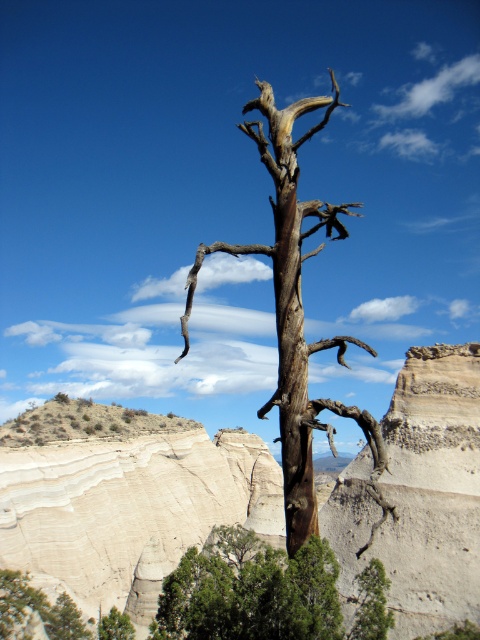
You are an artist sketching this landscape. You want to draw the brown rough bark tree at center and the green matte tree at lower right. Which tree should you sketch first if you follow the rule of drawing closer objects before distant ones?

The brown rough bark tree at center should be sketched first because it is closer to the viewer than the green matte tree at lower right.

You are a hiker who wants to take a photo of the smooth sandstone cliff at center and the green leafy tree at lower center. Where should you position yourself to capture both in the frame?

To capture both the smooth sandstone cliff at center and the green leafy tree at lower center in the frame, position yourself below the green leafy tree at lower center so that the cliff is above it in the background.

You are a hiker who wants to take a photo of both the brown rough bark tree at center and the green matte tree at lower right. Which tree should you focus on first to ensure both are in the frame?

You should focus on the brown rough bark tree at center first because it is located above the green matte tree at lower right, so adjusting the camera angle to include both would require framing from the top down.